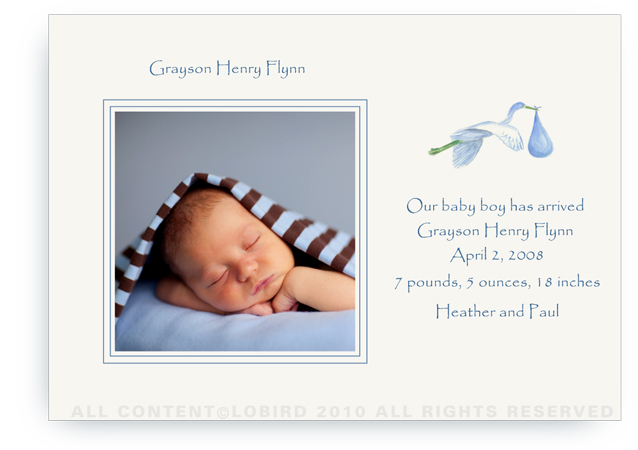
At what (x,y) coordinates should I click in order to perform the action: click on blanket. Please return your answer as a coordinate pair (x, y). Image resolution: width=638 pixels, height=450 pixels. Looking at the image, I should click on (124, 255).